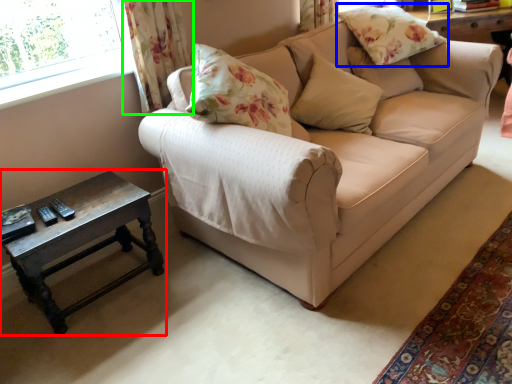
Question: Considering the real-world distances, which object is closest to table (highlighted by a red box)? pillow (highlighted by a blue box) or curtain (highlighted by a green box).

Choices:
 (A) pillow
 (B) curtain

Answer: (B)